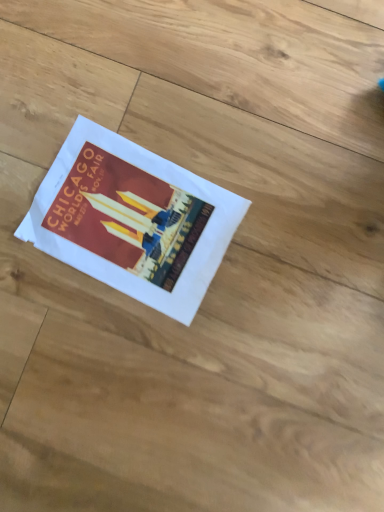
Image resolution: width=384 pixels, height=512 pixels. What do you see at coordinates (133, 220) in the screenshot? I see `white paper at center` at bounding box center [133, 220].

At what (x,y) coordinates should I click in order to perform the action: click on white paper at center. Please return your answer as a coordinate pair (x, y). Looking at the image, I should click on (133, 220).

At what (x,y) coordinates should I click in order to perform the action: click on white paper at center. Please return your answer as a coordinate pair (x, y). The width and height of the screenshot is (384, 512). Looking at the image, I should click on (133, 220).